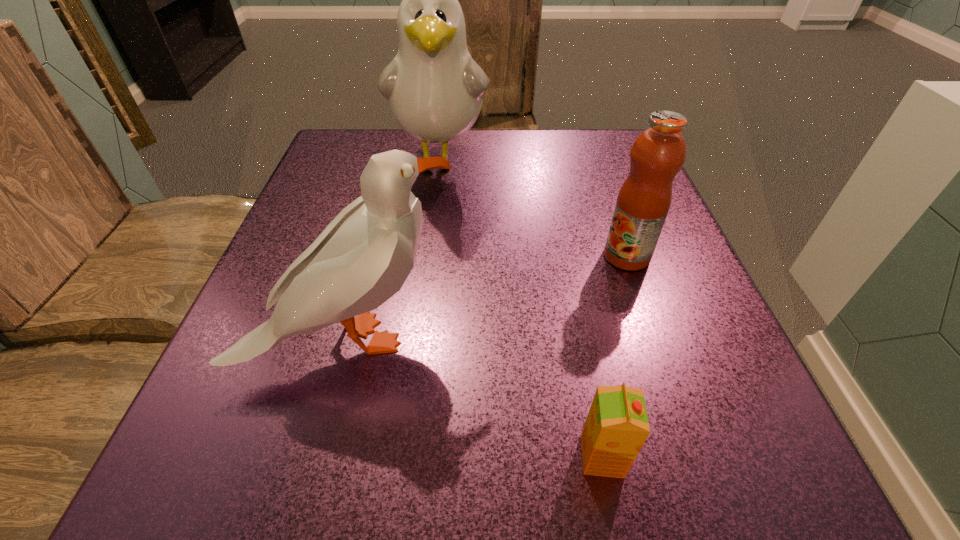
You are a GUI agent. You are given a task and a screenshot of the screen. Output one action in this format:
    pyautogui.click(x=<x>, y=<y>)
    Task: Click on the blank region between the farthest object and the orange juice
    
    Given the screenshot: What is the action you would take?
    pyautogui.click(x=521, y=308)

You are a GUI agent. You are given a task and a screenshot of the screen. Output one action in this format:
    pyautogui.click(x=<x>, y=<y>)
    Task: Click on the empty space between the third farthest object and the nearest object
    This screenshot has width=960, height=540.
    Given the screenshot: What is the action you would take?
    pyautogui.click(x=477, y=397)

The width and height of the screenshot is (960, 540). Identify the location of free space between the tallest object and the nearest object. (521, 308).

Identify the location of empty space between the shortest object and the nearer gull. (477, 397).

Locate an element on the screen. object that stands as the second closest to the rightmost object is located at coordinates (363, 257).

Select which object is the second closest to the shorter gull. Please provide its 2D coordinates. Your answer should be formatted as a tuple, i.e. [(x, y)], where the tuple contains the x and y coordinates of a point satisfying the conditions above.

[(658, 153)]

At what (x,y) coordinates should I click in order to perform the action: click on free space that satisfies the following two spatial constraints: 1. on the beak of the tallest object; 2. at the beak of the nearer gull. Please return your answer as a coordinate pair (x, y). This screenshot has height=540, width=960. Looking at the image, I should click on (419, 339).

Identify the location of blank area in the image that satisfies the following two spatial constraints: 1. on the beak of the taller gull; 2. on the right side of the shortest object. (404, 456).

You are a GUI agent. You are given a task and a screenshot of the screen. Output one action in this format:
    pyautogui.click(x=<x>, y=<y>)
    Task: Click on the vacant position in the image that satisfies the following two spatial constraints: 1. at the beak of the second nearest object; 2. on the left side of the nearest object
    This screenshot has width=960, height=540.
    Given the screenshot: What is the action you would take?
    pyautogui.click(x=322, y=456)

You are a GUI agent. You are given a task and a screenshot of the screen. Output one action in this format:
    pyautogui.click(x=<x>, y=<y>)
    Task: Click on the free location that satisfies the following two spatial constraints: 1. at the beak of the shortest object; 2. on the right side of the shorter gull
    This screenshot has width=960, height=540.
    Given the screenshot: What is the action you would take?
    pyautogui.click(x=322, y=456)